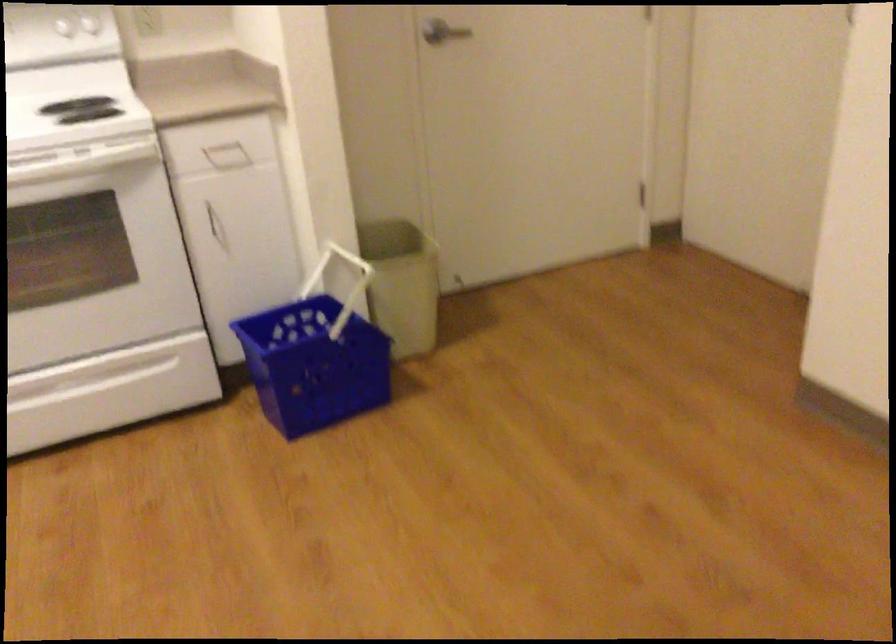
At what (x,y) coordinates should I click in order to perform the action: click on beige trash can. Please return your answer as a coordinate pair (x, y). Looking at the image, I should click on (401, 283).